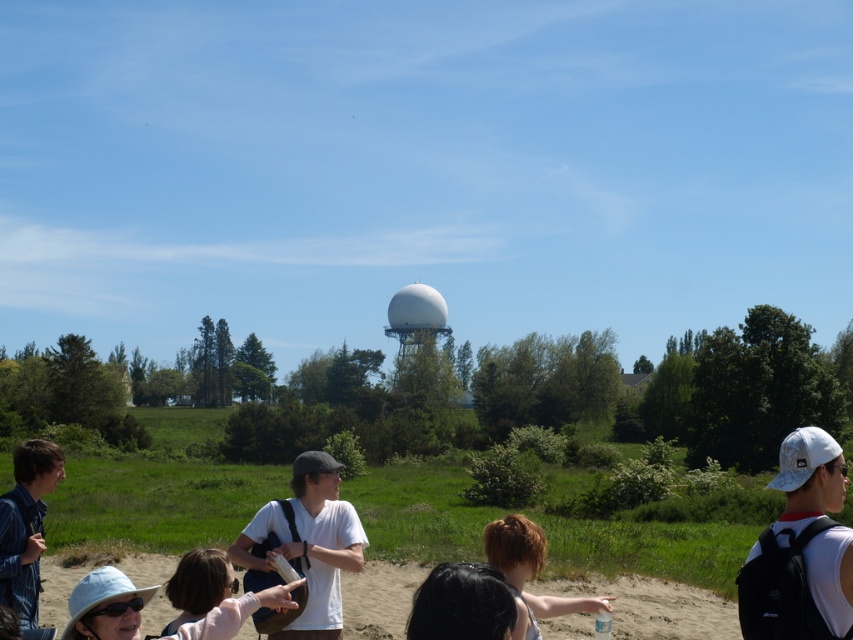
Describe the element at coordinates (105, 605) in the screenshot. I see `matte white hat at lower left` at that location.

Does point (236, 628) come in front of point (404, 330)?

Yes, it is.

Is point (93, 618) closer to viewer compared to point (405, 340)?

Yes.

Identify the location of matte white hat at lower left. (105, 605).

Is point (840, 636) positioned after point (33, 572)?

No, it is not.

Is white matte cap at upper right wider than denim jacket at lower left?

Correct, the width of white matte cap at upper right exceeds that of denim jacket at lower left.

I want to click on white matte cap at upper right, so click(804, 545).

Can you confirm if black hair at lower center is shorter than white matte sphere at center?

Indeed, black hair at lower center has a lesser height compared to white matte sphere at center.

Does black hair at lower center come in front of white matte sphere at center?

Yes, it is in front of white matte sphere at center.

Which is in front, point (445, 628) or point (421, 312)?

Positioned in front is point (445, 628).

This screenshot has width=853, height=640. I want to click on black hair at lower center, so [461, 604].